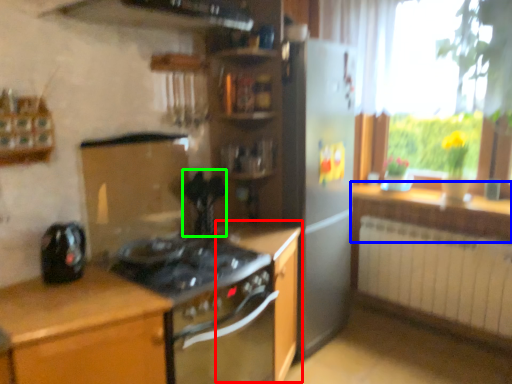
Question: Which object is the closest to the cabinetry (highlighted by a red box)? Choose among these: countertop (highlighted by a blue box) or appliance (highlighted by a green box).

Choices:
 (A) countertop
 (B) appliance

Answer: (B)